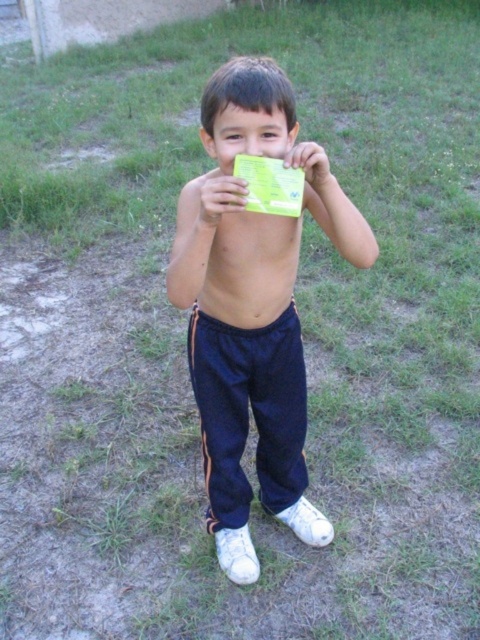
Does navy blue track pants at center appear over smooth skin face at center?

No.

Is navy blue track pants at center taller than smooth skin face at center?

Indeed, navy blue track pants at center has a greater height compared to smooth skin face at center.

Which is in front, point (228, 282) or point (252, 150)?

Point (252, 150) is more forward.

Find the location of a particular element. The height and width of the screenshot is (640, 480). navy blue track pants at center is located at coordinates (243, 362).